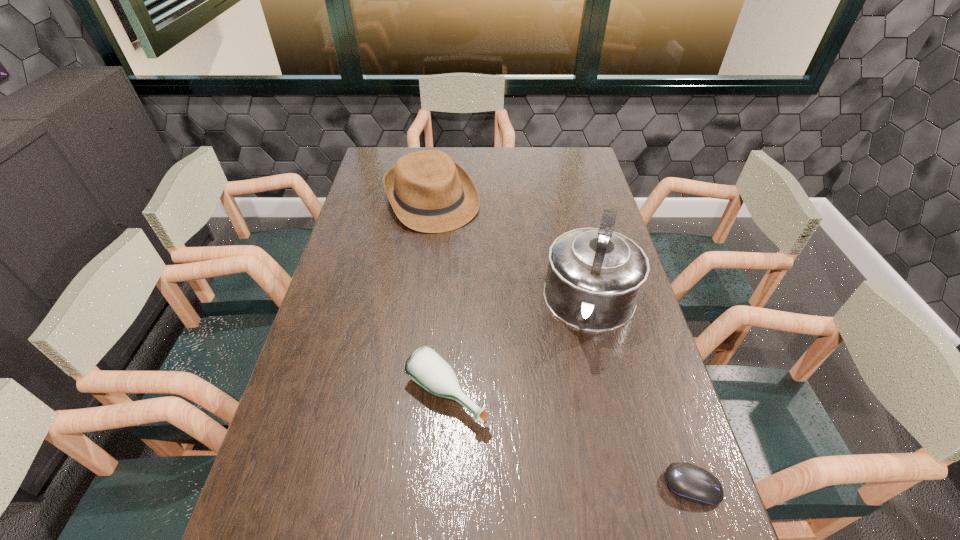
Where is `vacant spot on the desktop that is between the third farthest object and the computer mouse and is positioned on the front-facing side of the third shortest object`? The width and height of the screenshot is (960, 540). vacant spot on the desktop that is between the third farthest object and the computer mouse and is positioned on the front-facing side of the third shortest object is located at coordinates (576, 443).

What are the coordinates of `free space on the desktop that is between the second nearest object and the shortest object and is positioned with the spout at the front of the tallest object` in the screenshot? It's located at (563, 437).